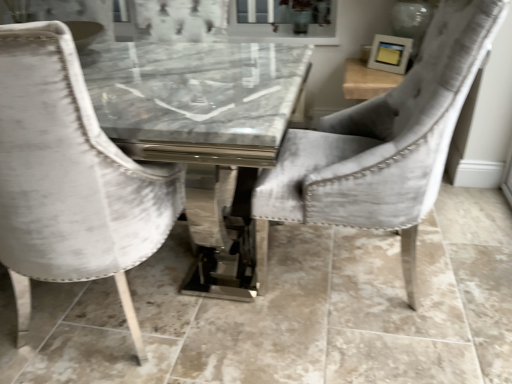
Locate an element on the screen. This screenshot has width=512, height=384. vacant space to the right of velvet gray chair at center, the 2th chair positioned from the left is located at coordinates (469, 251).